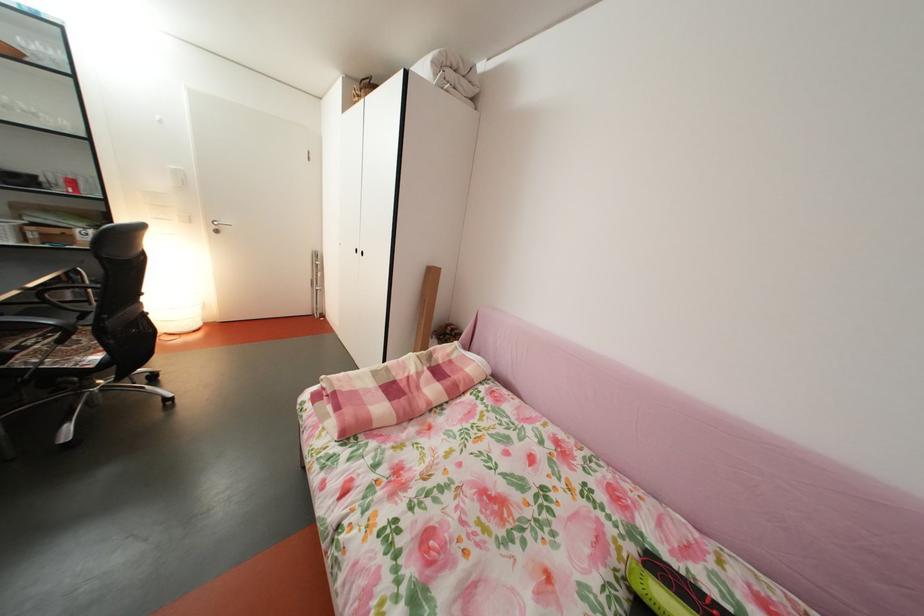
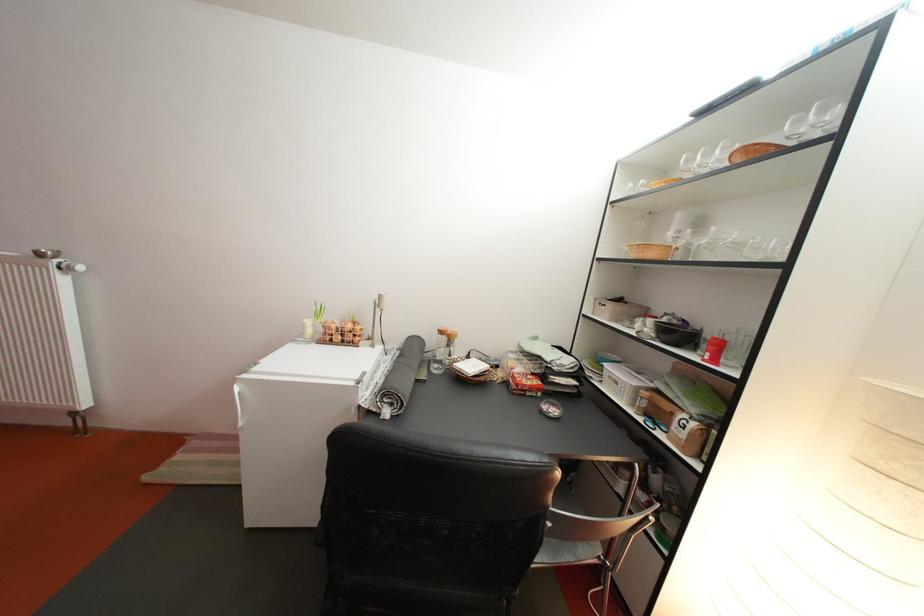
Locate, in the second image, the point that corresponds to pixel 43 235 in the first image.

(658, 400)